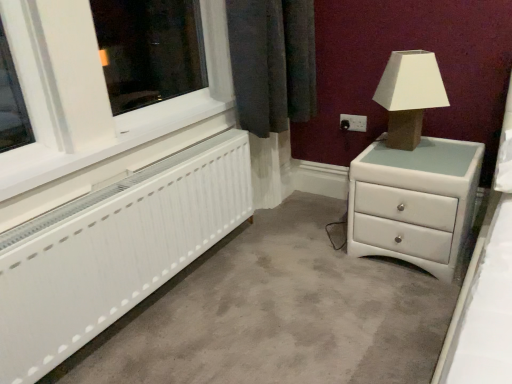
I want to click on white matte radiator at lower left, so (114, 251).

Where is `matte brown table lamp at upper right`? matte brown table lamp at upper right is located at coordinates (409, 95).

Measure the distance between black plastic electric outlet at upper right and camera.

The distance of black plastic electric outlet at upper right from camera is 7.39 feet.

Where is `white plastic window frame at left`? The width and height of the screenshot is (512, 384). white plastic window frame at left is located at coordinates (90, 92).

Considering the relative positions of white glossy chest of drawers at right and matte brown table lamp at upper right in the image provided, is white glossy chest of drawers at right behind matte brown table lamp at upper right?

No, the depth of white glossy chest of drawers at right is less than that of matte brown table lamp at upper right.

Considering the points (413, 160) and (390, 101), which point is in front, point (413, 160) or point (390, 101)?

Point (413, 160)

From the image's perspective, between white glossy chest of drawers at right and matte brown table lamp at upper right, who is located below?

white glossy chest of drawers at right.

Considering the points (34, 321) and (414, 212), which point is behind, point (34, 321) or point (414, 212)?

The point (414, 212) is more distant.

Who is bigger, white matte radiator at lower left or white glossy chest of drawers at right?

With larger size is white glossy chest of drawers at right.

From a real-world perspective, which object stands above the other?

white matte radiator at lower left, from a real-world perspective.

Can you confirm if white matte radiator at lower left is thinner than white glossy chest of drawers at right?

Yes.

You are a GUI agent. You are given a task and a screenshot of the screen. Output one action in this format:
    pyautogui.click(x=<x>, y=<y>)
    Task: Click on the window frame behind the white matte radiator at lower left
    This screenshot has width=512, height=384.
    Given the screenshot: What is the action you would take?
    pyautogui.click(x=90, y=92)

Could you tell me if white matte radiator at lower left is facing white plastic window frame at left?

No, white matte radiator at lower left is not turned towards white plastic window frame at left.

Between white matte radiator at lower left and white plastic window frame at left, which one has smaller size?

With smaller size is white plastic window frame at left.

Considering the sizes of white matte radiator at lower left and white plastic window frame at left in the image, is white matte radiator at lower left wider or thinner than white plastic window frame at left?

In the image, white matte radiator at lower left appears to be more narrow than white plastic window frame at left.

In the image, is white matte radiator at lower left on the left side or the right side of black plastic electric outlet at upper right?

white matte radiator at lower left is positioned on black plastic electric outlet at upper right's left side.

Is white matte radiator at lower left with black plastic electric outlet at upper right?

No, white matte radiator at lower left is not beside black plastic electric outlet at upper right.

Is white matte radiator at lower left closer to the viewer compared to black plastic electric outlet at upper right?

Yes.

Is white matte radiator at lower left facing away from black plastic electric outlet at upper right?

No, black plastic electric outlet at upper right is not at the back of white matte radiator at lower left.

Between point (360, 126) and point (234, 209), which one is positioned behind?

Positioned behind is point (360, 126).

Does black plastic electric outlet at upper right turn towards white matte radiator at lower left?

Yes.

Is white matte radiator at lower left inside black plastic electric outlet at upper right?

Actually, white matte radiator at lower left is outside black plastic electric outlet at upper right.

Considering the relative sizes of black plastic electric outlet at upper right and white matte radiator at lower left in the image provided, is black plastic electric outlet at upper right taller than white matte radiator at lower left?

Answer: Incorrect, the height of black plastic electric outlet at upper right is not larger of that of white matte radiator at lower left.

From the image's perspective, between matte brown table lamp at upper right and black plastic electric outlet at upper right, which one is located above?

From the image's view, matte brown table lamp at upper right is above.

Identify the location of table lamp on the right of black plastic electric outlet at upper right. The width and height of the screenshot is (512, 384). (409, 95).

Is matte brown table lamp at upper right not inside black plastic electric outlet at upper right?

Absolutely, matte brown table lamp at upper right is external to black plastic electric outlet at upper right.

Considering the sizes of objects matte brown table lamp at upper right and black plastic electric outlet at upper right in the image provided, who is smaller, matte brown table lamp at upper right or black plastic electric outlet at upper right?

Smaller between the two is black plastic electric outlet at upper right.

From a real-world perspective, is white plastic window frame at left physically above black plastic electric outlet at upper right?

Correct, in the physical world, white plastic window frame at left is higher than black plastic electric outlet at upper right.

Looking at their sizes, would you say white plastic window frame at left is wider or thinner than black plastic electric outlet at upper right?

Considering their sizes, white plastic window frame at left looks broader than black plastic electric outlet at upper right.

Image resolution: width=512 pixels, height=384 pixels. What are the coordinates of `electric outlet that appears below the white plastic window frame at left (from a real-world perspective)` in the screenshot? It's located at (353, 122).

Visually, is white plastic window frame at left positioned to the left or to the right of black plastic electric outlet at upper right?

In the image, white plastic window frame at left appears on the left side of black plastic electric outlet at upper right.

Where is `table lamp above the white glossy chest of drawers at right (from the image's perspective)`? This screenshot has width=512, height=384. table lamp above the white glossy chest of drawers at right (from the image's perspective) is located at coordinates (409, 95).

Find the location of `the chest of drawers behind the white matte radiator at lower left`. the chest of drawers behind the white matte radiator at lower left is located at coordinates (414, 202).

Based on their spatial positions, is matte brown table lamp at upper right or black plastic electric outlet at upper right further from white glossy chest of drawers at right?

black plastic electric outlet at upper right.

From the image, which object appears to be nearer to white matte radiator at lower left, black plastic electric outlet at upper right or white plastic window frame at left?

white plastic window frame at left.

Considering their positions, is white matte radiator at lower left positioned closer to matte brown table lamp at upper right than black plastic electric outlet at upper right?

Based on the image, black plastic electric outlet at upper right appears to be nearer to matte brown table lamp at upper right.

Which object lies nearer to the anchor point white glossy chest of drawers at right, white matte radiator at lower left or white plastic window frame at left?

white matte radiator at lower left lies closer to white glossy chest of drawers at right than the other object.

In the scene shown: Estimate the real-world distances between objects in this image. Which object is further from matte brown table lamp at upper right, white plastic window frame at left or white glossy chest of drawers at right?

white plastic window frame at left is further to matte brown table lamp at upper right.

Looking at the image, which one is located closer to white glossy chest of drawers at right, black plastic electric outlet at upper right or white matte radiator at lower left?

black plastic electric outlet at upper right is positioned closer to the anchor white glossy chest of drawers at right.

From the image, which object appears to be farther from matte brown table lamp at upper right, white plastic window frame at left or black plastic electric outlet at upper right?

white plastic window frame at left.

When comparing their distances from white matte radiator at lower left, does white glossy chest of drawers at right or white plastic window frame at left seem closer?

The object closer to white matte radiator at lower left is white plastic window frame at left.

Where is `table lamp between white plastic window frame at left and white glossy chest of drawers at right`? table lamp between white plastic window frame at left and white glossy chest of drawers at right is located at coordinates (409, 95).

Find the location of a particular element. This screenshot has height=384, width=512. radiator between white plastic window frame at left and matte brown table lamp at upper right from left to right is located at coordinates (114, 251).

This screenshot has width=512, height=384. I want to click on electric outlet situated between white plastic window frame at left and white glossy chest of drawers at right from left to right, so point(353,122).

Image resolution: width=512 pixels, height=384 pixels. Find the location of `table lamp positioned between white matte radiator at lower left and black plastic electric outlet at upper right from near to far`. table lamp positioned between white matte radiator at lower left and black plastic electric outlet at upper right from near to far is located at coordinates (409, 95).